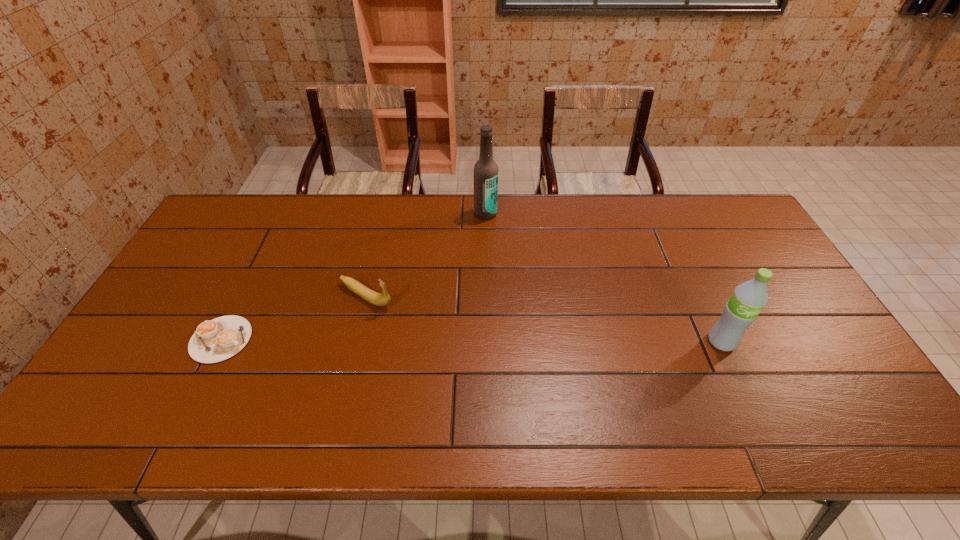
The image size is (960, 540). I want to click on free space on the desktop that is between the leftmost object and the second tallest object and is positioned at the stem of the second shortest object, so click(442, 340).

Find the location of a particular element. This screenshot has height=540, width=960. vacant space on the desktop that is between the leftmost object and the water bottle and is positioned on the side of the tallest object with the label is located at coordinates (492, 341).